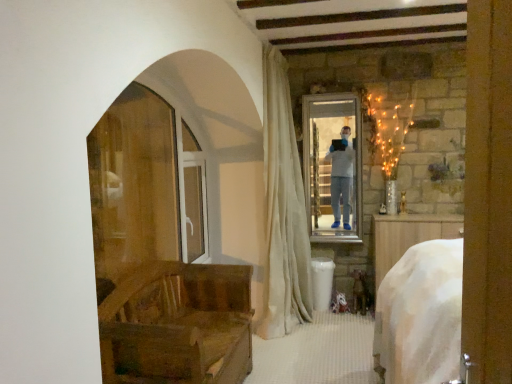
Question: Would you say wooden chair at left is inside or outside white velvet curtain at center?

Choices:
 (A) outside
 (B) inside

Answer: (A)

Question: From a real-world perspective, is wooden chair at left positioned above or below white velvet curtain at center?

Choices:
 (A) above
 (B) below

Answer: (B)

Question: Which object is positioned farthest from the clear glass screen door at center?

Choices:
 (A) wooden chair at left
 (B) white velvet curtain at center

Answer: (A)

Question: Estimate the real-world distances between objects in this image. Which object is farther from the clear glass screen door at center?

Choices:
 (A) wooden chair at left
 (B) white velvet curtain at center

Answer: (A)